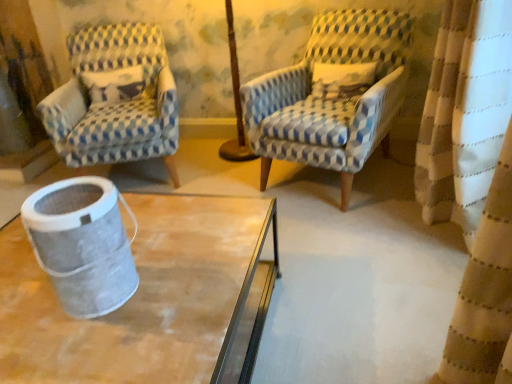
Question: Is metallic mesh trash can at lower left wider or thinner than blue and white checkered fabric armchair at center, arranged as the first chair when viewed from the right?

Choices:
 (A) thin
 (B) wide

Answer: (A)

Question: Based on their positions, is metallic mesh trash can at lower left located to the left or right of blue and white checkered fabric armchair at center, arranged as the second chair when viewed from the left?

Choices:
 (A) left
 (B) right

Answer: (A)

Question: Estimate the real-world distances between objects in this image. Which object is farther from the blue and white checkered fabric armchair at left, the first chair positioned from the left?

Choices:
 (A) metallic mesh trash can at lower left
 (B) blue and white checkered fabric armchair at center, arranged as the second chair when viewed from the left

Answer: (A)

Question: Estimate the real-world distances between objects in this image. Which object is farther from the blue and white checkered fabric armchair at center, arranged as the first chair when viewed from the right?

Choices:
 (A) metallic mesh trash can at lower left
 (B) blue and white checkered fabric armchair at left, the 2th chair positioned from the right

Answer: (A)